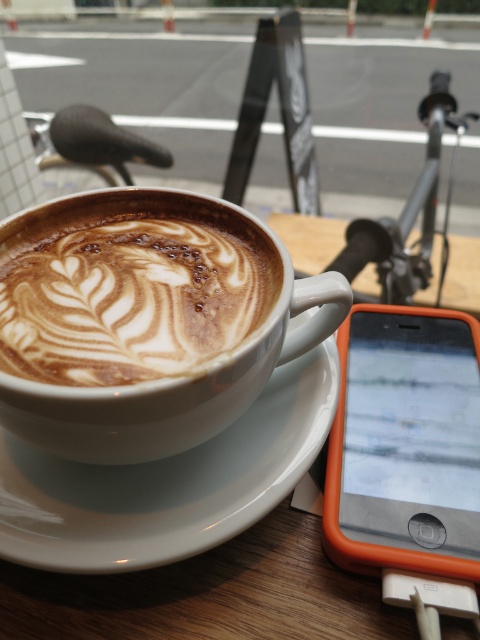
Question: Which point is closer to the camera?

Choices:
 (A) cappuccino foam at center
 (B) orange plastic smartphone at lower right

Answer: (A)

Question: Which point appears closest to the camera in this image?

Choices:
 (A) (274, 449)
 (B) (107, 285)
 (C) (339, 557)

Answer: (C)

Question: Which object is positioned farthest from the orange plastic smartphone at lower right?

Choices:
 (A) cappuccino foam at center
 (B) white ceramic saucer at center

Answer: (A)

Question: Considering the relative positions of cappuccino foam at center and orange plastic smartphone at lower right in the image provided, where is cappuccino foam at center located with respect to orange plastic smartphone at lower right?

Choices:
 (A) left
 (B) right

Answer: (A)

Question: Where is white ceramic saucer at center located in relation to orange plastic smartphone at lower right in the image?

Choices:
 (A) below
 (B) above

Answer: (A)

Question: Is cappuccino foam at center to the right of orange plastic smartphone at lower right from the viewer's perspective?

Choices:
 (A) yes
 (B) no

Answer: (B)